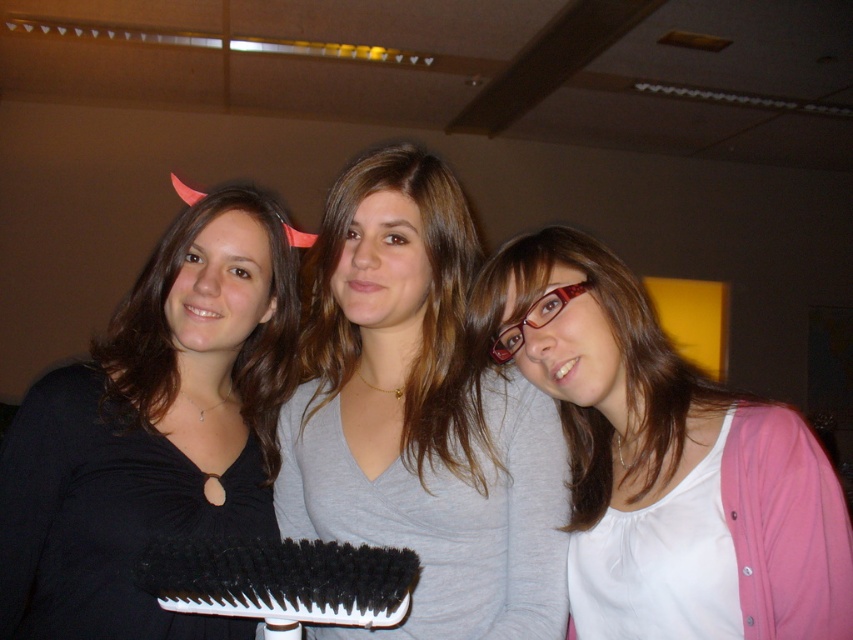
Is pink fabric at center shorter than black bristle brush at center?

In fact, pink fabric at center may be taller than black bristle brush at center.

This screenshot has width=853, height=640. Describe the element at coordinates (664, 461) in the screenshot. I see `pink fabric at center` at that location.

Is point (473, 352) positioned behind point (172, 564)?

Yes.

This screenshot has height=640, width=853. I want to click on pink fabric at center, so click(664, 461).

Is black matte brush at left wider than black bristle brush at center?

Correct, the width of black matte brush at left exceeds that of black bristle brush at center.

Is point (129, 467) closer to viewer compared to point (370, 595)?

No, it is not.

Locate an element on the screen. This screenshot has width=853, height=640. black matte brush at left is located at coordinates (154, 429).

Can you confirm if gray matte shirt at center is positioned below pink fabric at center?

Incorrect, gray matte shirt at center is not positioned below pink fabric at center.

What do you see at coordinates (419, 413) in the screenshot? I see `gray matte shirt at center` at bounding box center [419, 413].

Is point (527, 396) less distant than point (579, 628)?

Yes, point (527, 396) is closer to viewer.

Image resolution: width=853 pixels, height=640 pixels. Find the location of `gray matte shirt at center`. gray matte shirt at center is located at coordinates (419, 413).